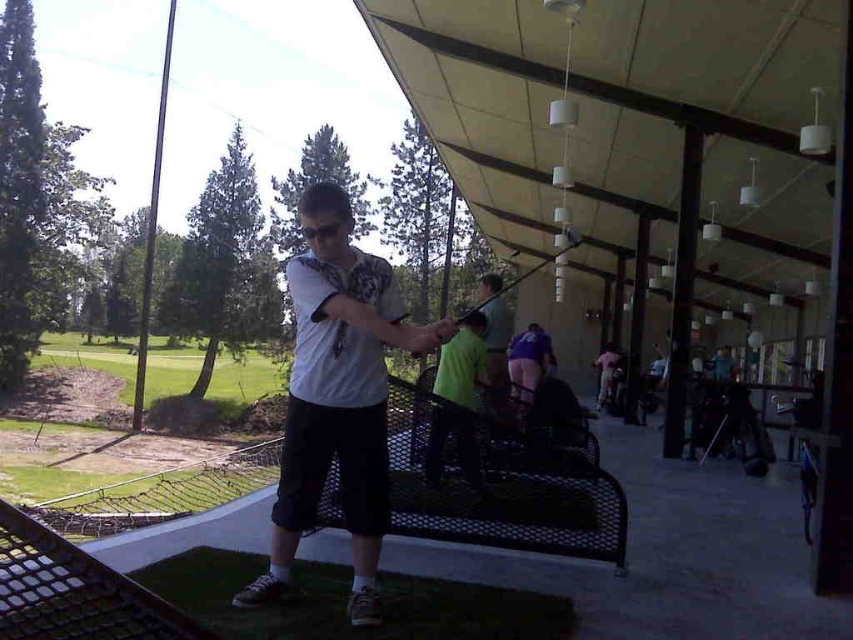
You are a photographer at the driving range and want to capture a photo of the golfer. Since the neon green shirt at center and the purple fabric shorts at center are both in the frame, can you tell me which one is positioned higher on the golfer?

The neon green shirt at center is above the purple fabric shorts at center, so the neon green shirt at center is positioned higher.